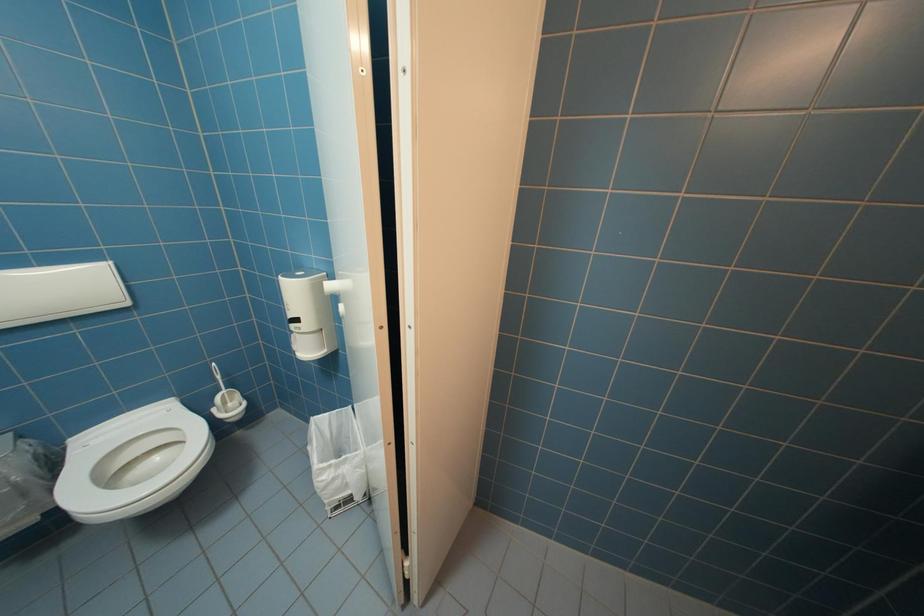
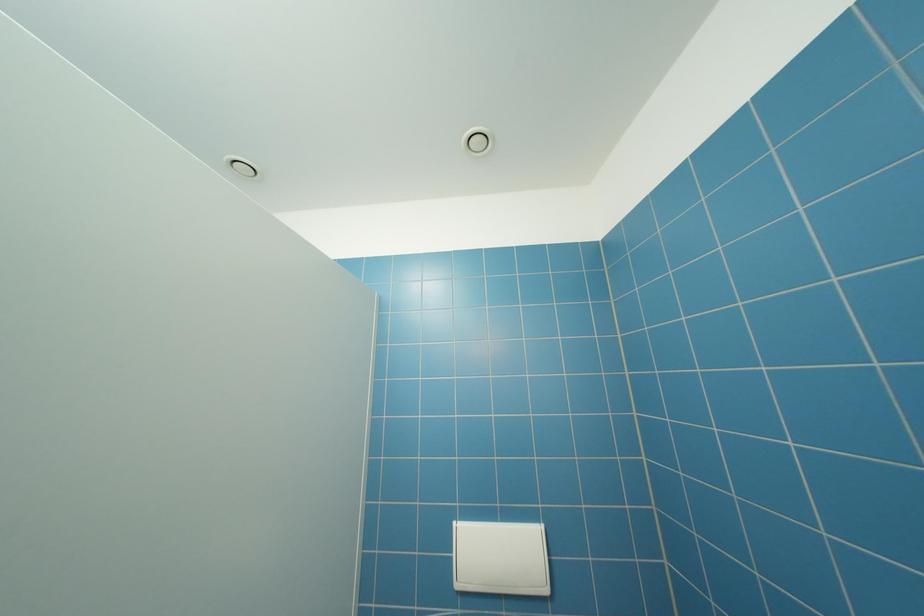
First-person continuous shooting, in which direction is the camera rotating?

The camera rotated toward left-up.